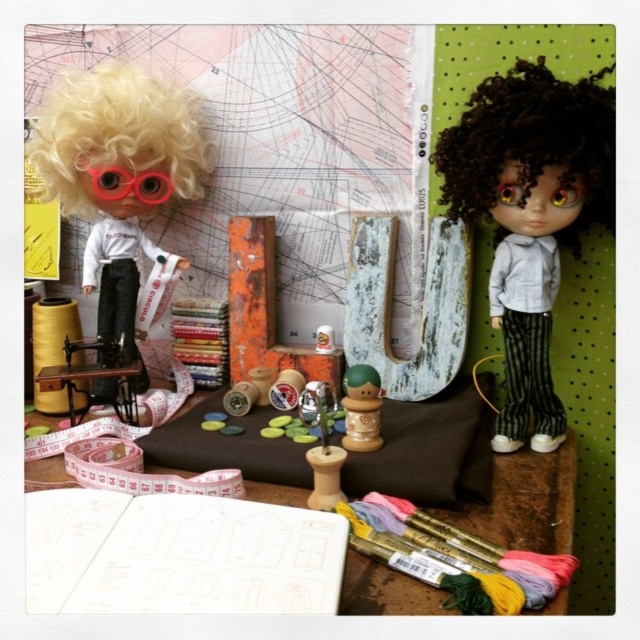
You are a tiny robot in the sewing workspace. You need to retrieve the rubberized plastic goggles at upper left but first must pass by the curly brown hair at upper right. Is the path clear to reach the goggles?

The curly brown hair at upper right is located above the rubberized plastic goggles at upper left, so the path is clear to reach the goggles as the hair is above and not blocking the way.

What are the coordinates of the matte gray doll at center?

The matte gray doll at center is located at coordinates point (531, 209).

Please provide the exact 2D coordinates of the blonde curly wig at upper left in the image.

The blonde curly wig at upper left is located at coordinates point (120, 141).